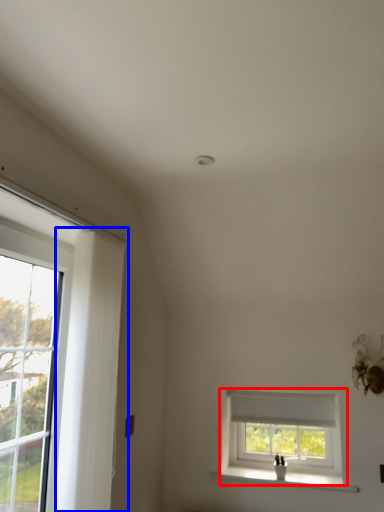
Question: Which point is further to the camera, window (highlighted by a red box) or curtain (highlighted by a blue box)?

Choices:
 (A) window
 (B) curtain

Answer: (A)